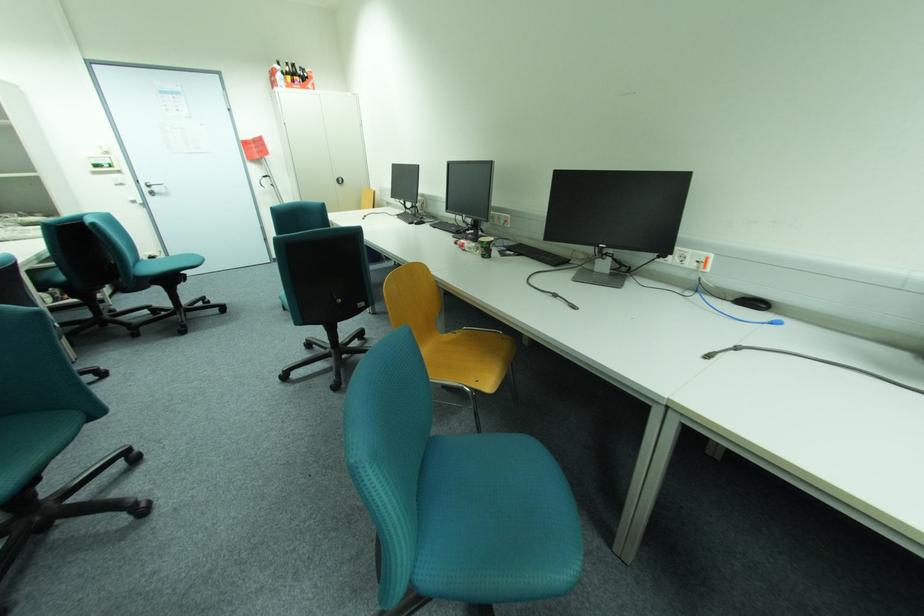
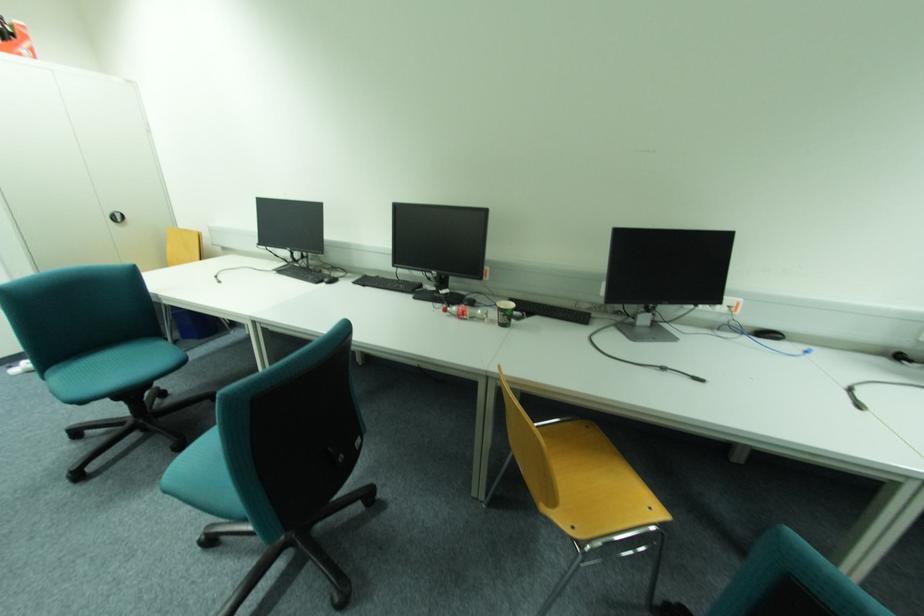
In the second image, find the point that corresponds to pixel 421 222 in the first image.

(333, 280)